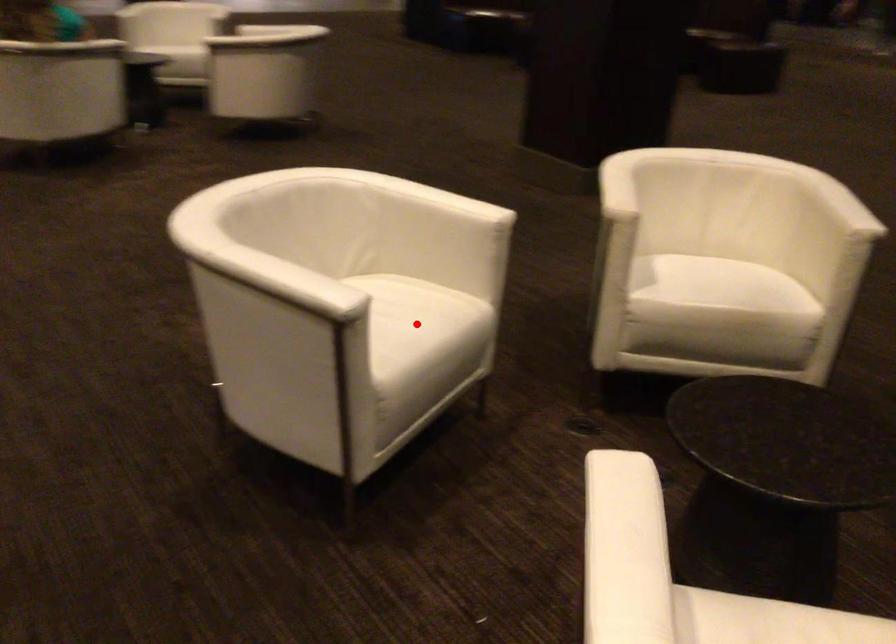
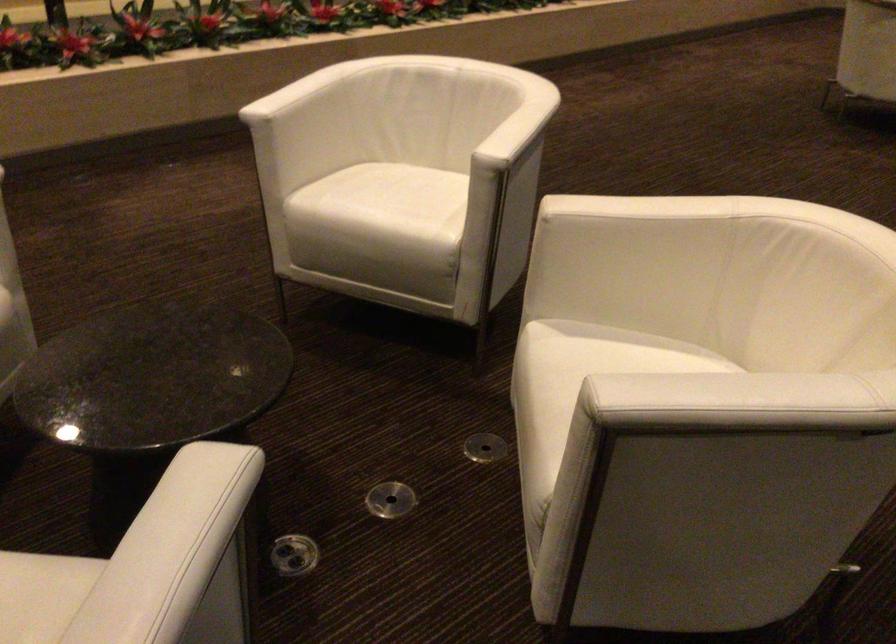
Locate, in the second image, the point that corresponds to the highlighted location in the first image.

(383, 205)